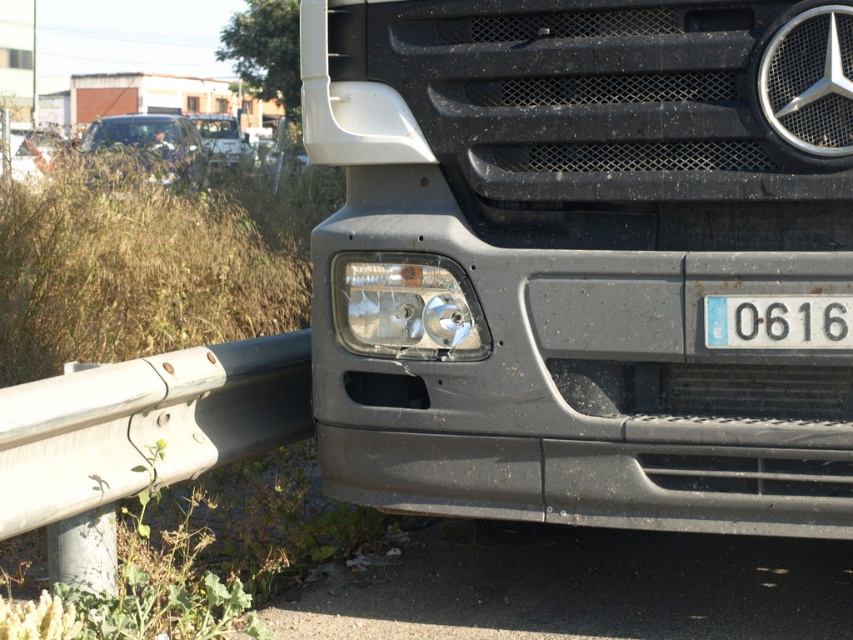
Based on the photo, you are a mechanic inspecting the front of the truck. You notice the white metallic rail at lower left and the transparent plastic headlight at lower left. Which object is nearer to you?

The white metallic rail at lower left is closer to the viewer than the transparent plastic headlight at lower left.

You are a mechanic inspecting a truck and notice the transparent plastic headlight at lower left and the white plastic license plate at center. Which object is positioned to the left of the other?

The transparent plastic headlight at lower left is to the left of the white plastic license plate at center.

You are a mechanic inspecting the front of the truck. You notice the white metallic rail at lower left and the white plastic license plate at center. Which object is wider?

The white metallic rail at lower left is wider than the white plastic license plate at center according to the description.